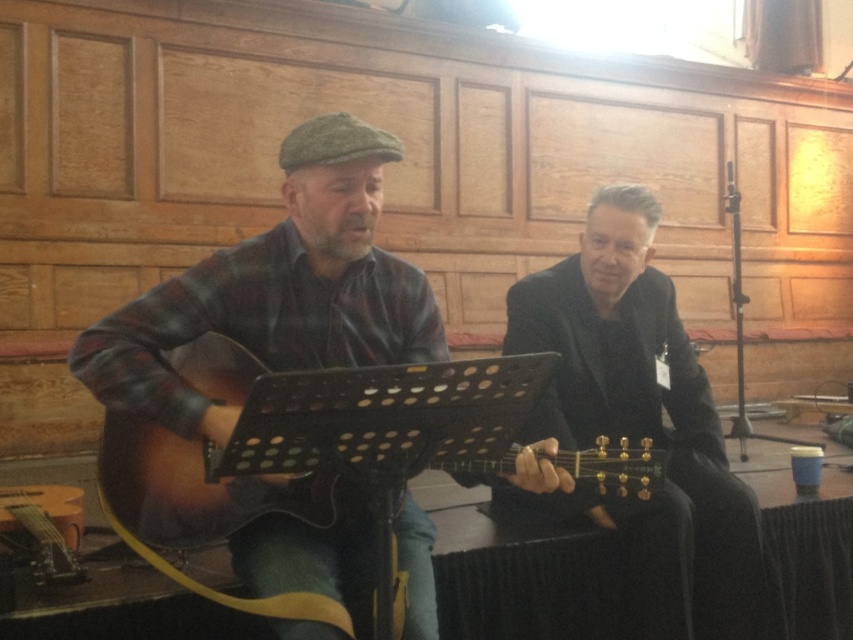
You are a photographer setting up a shot of the two people in the scene. You want to ensure that the matte plaid shirt at center and the sunburst wood guitar at center are both clearly visible. Based on their positions, which object should you focus on first to ensure both are in frame?

The matte plaid shirt at center is located above the sunburst wood guitar at center, so focusing on the matte plaid shirt at center first will ensure both are in frame since it is positioned higher up.

You are a photographer standing in the room with the matte plaid shirt at center. You want to take a photo of the shirt using your camera. Can you reach the camera from your current position without moving?

The matte plaid shirt at center and camera are 4.99 feet apart, so you can easily reach the camera from your current position to take a photo of the shirt since 4.99 feet is within a comfortable reaching distance.

You are standing in the room and want to place a small plant between the two points, point 1 at point (x=340, y=595) and point 2 at point (x=666, y=353). Which point should the plant be closer to if you want it to be closer to the person playing the guitar?

The plant should be closer to point 1 at (x=340, y=595) because it is in front of point 2 at (x=666, y=353), meaning it is closer to the person playing the guitar.